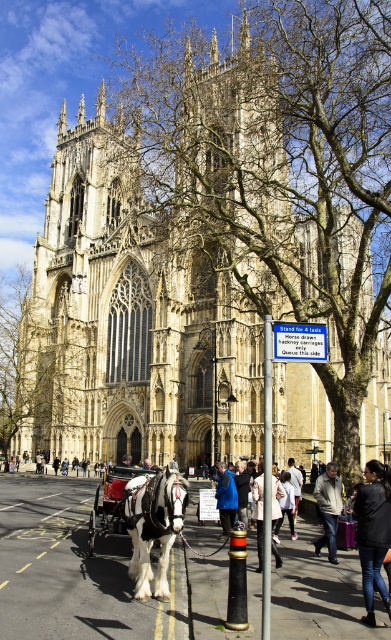
Question: Among these points, which one is farthest from the camera?

Choices:
 (A) tap(120, 337)
 (B) tap(261, 490)
 (C) tap(218, 486)

Answer: (A)

Question: Does shiny black cart at center have a greater width compared to dark brown leather jacket at lower right?

Choices:
 (A) no
 (B) yes

Answer: (B)

Question: Which object is positioned farthest from the light beige stone church at center?

Choices:
 (A) white cotton coat at center
 (B) shiny black cart at center

Answer: (A)

Question: From the image, what is the correct spatial relationship of black leather jacket at lower right in relation to blue jacket at center?

Choices:
 (A) below
 (B) above

Answer: (B)

Question: Which point is closer to the camera?

Choices:
 (A) black glossy horse at center
 (B) dark brown leather jacket at lower right

Answer: (A)

Question: Does black glossy horse at center lie behind black leather jacket at lower right?

Choices:
 (A) no
 (B) yes

Answer: (B)